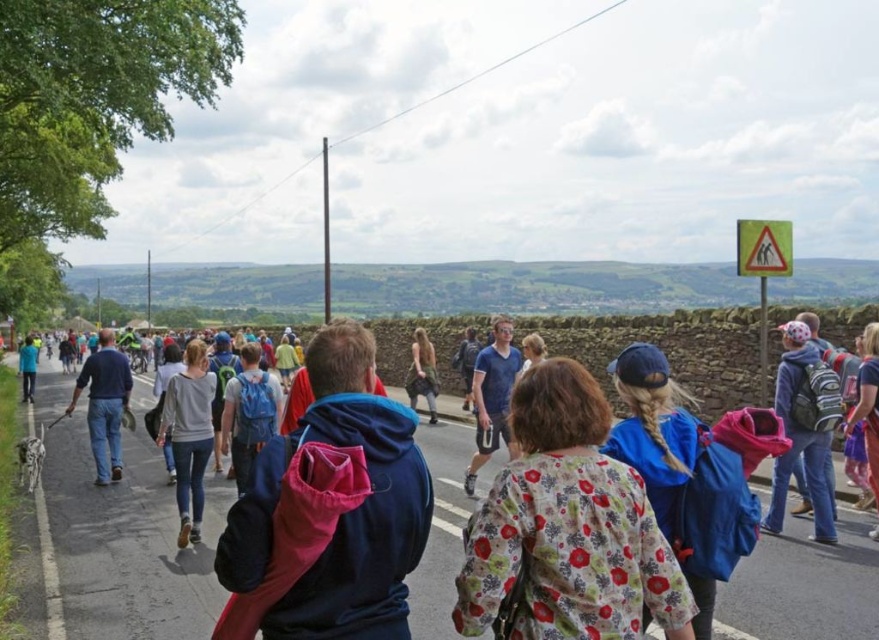
You are a photographer positioned at the back of the group. You want to capture a photo of both the blue hooded sweatshirt at center and the floral fabric jacket at center in the same frame. Which direction should you move to ensure both are visible?

The blue hooded sweatshirt at center is to the left of the floral fabric jacket at center. To include both in the frame, you should move to the right side so that you can capture both objects in your shot.

You are organizing a group photo and need to arrange the blue hooded sweatshirt at center and the floral fabric jacket at center so that both are visible in the frame. Given their sizes, which clothing item should be placed closer to the camera to ensure both are fully visible?

The blue hooded sweatshirt at center is bigger than the floral fabric jacket at center, so placing the larger blue hooded sweatshirt at center closer to the camera will help ensure both are fully visible in the frame.